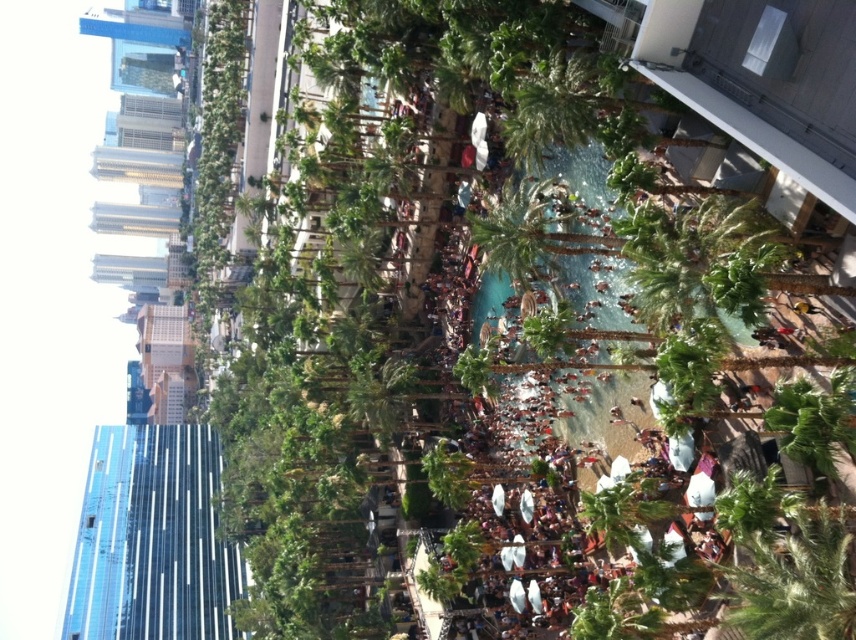
Based on the photo, you are standing at the edge of the pool and want to take a photo of both the transparent glass building at left and the green leafy palm tree at center. Which object should you position to your left side in the frame to include both in the photo?

You should position the transparent glass building at left to your left side in the frame because it is already to the left of the green leafy palm tree at center, allowing both to be captured in the photo.

You are a drone operator tasked with capturing aerial footage of the transparent glass building at left and the green leafy palm tree at center. The drone has a maximum flight range of 150 meters. Can the drone capture both subjects in a single flight without needing to recharge?

The distance between the transparent glass building at left and the green leafy palm tree at center is 146.23 meters. Since this is under the drone maximum flight range of 150 meters, the drone can capture both subjects in a single flight without needing to recharge.

You are standing at the edge of the pool and see two points marked in the scene. The first point is at coordinates point (134, 614) and the second is at point (544, 259). Which point is closer to you?

Point (134, 614) is closer to you because it is further to the viewer than point (544, 259).